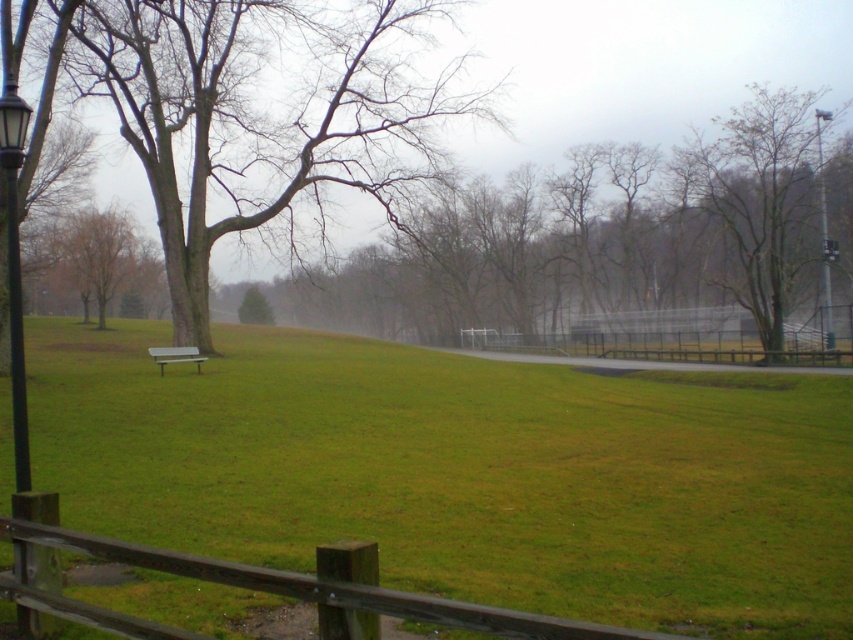
You are standing at the wooden fence in the foreground of the park scene. You see a white bench on the left and bare branches at center. Which object is closer to you, the viewer?

The bare branches at center is closer to you because it is located at point (601, 241), which is nearer in the coordinate system compared to the white bench on the left.

You are planning to sit on the metallic silver bench at center but want to avoid the bare branches at center above you. Is there enough space between the bench and the branches to sit comfortably?

The bare branches at center are positioned over the metallic silver bench at center, so there may not be enough space between them to sit comfortably without the branches being too close or obstructive.